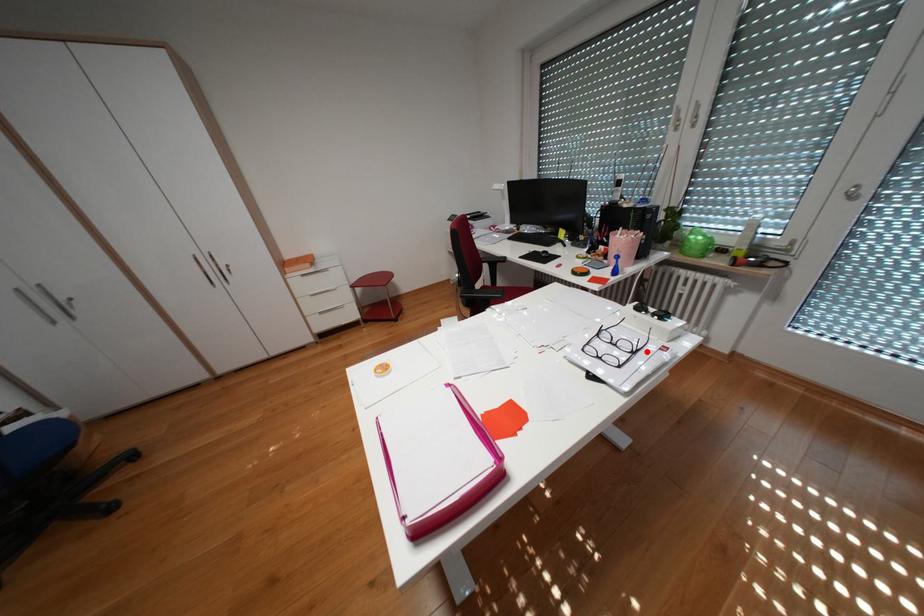
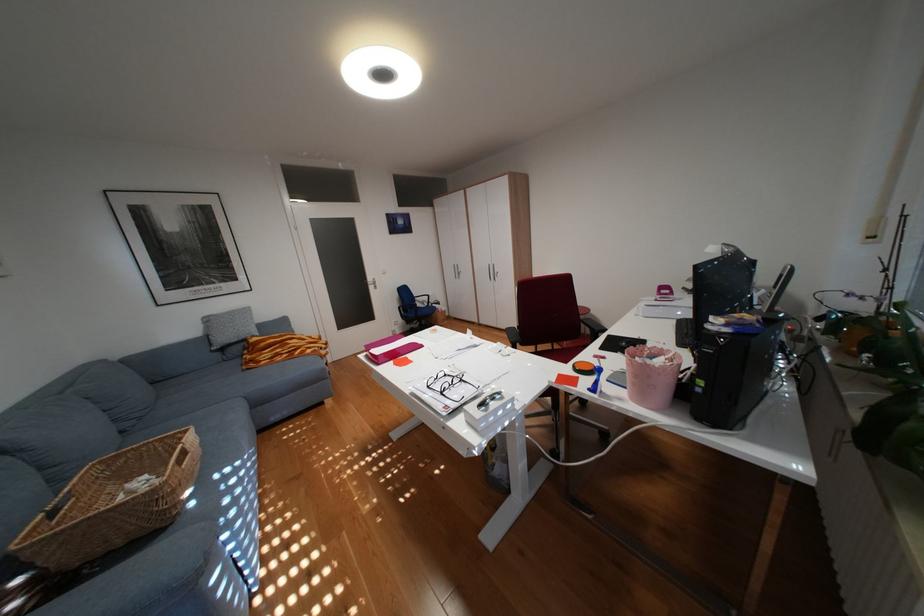
In the second image, find the point that corresponds to the highlighted location in the first image.

(454, 392)